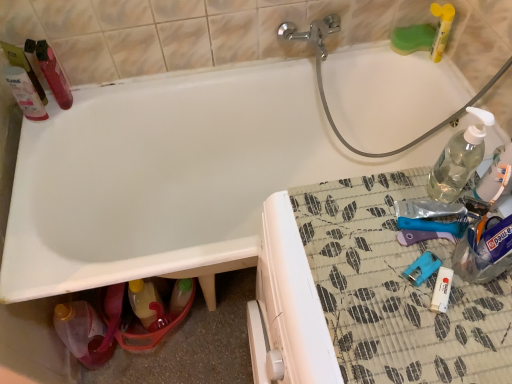
Question: Considering the positions of point (144, 304) and point (510, 183), is point (144, 304) closer or farther from the camera than point (510, 183)?

Choices:
 (A) closer
 (B) farther

Answer: (B)

Question: Which is correct: translucent yellow bottle at lower left, which is counted as the 2th bottle, starting from the bottom, is inside clear plastic bottle at upper right, positioned as the 5th bottle in left-to-right order, or outside of it?

Choices:
 (A) outside
 (B) inside

Answer: (A)

Question: Which is farther from the clear plastic bottle at upper right, which is counted as the third bottle, starting from the top?

Choices:
 (A) clear plastic bottle at upper right, the 4th bottle positioned from the left
 (B) translucent plastic bottle at lower left, the 4th bottle when ordered from right to left
 (C) translucent plastic bottle at upper left, placed as the first bottle when sorted from left to right
 (D) translucent yellow bottle at lower left, which is the 3th bottle from right to left
 (E) translucent plastic bottles at upper left

Answer: (E)

Question: Based on their relative distances, which object is farther from the translucent plastic bottles at upper left?

Choices:
 (A) clear plastic bottle at upper right, which appears as the 1th bottle when viewed from the right
 (B) clear plastic bottle at upper right, the 4th bottle positioned from the left
 (C) translucent plastic bottle at lower left, placed as the 5th bottle when sorted from top to bottom
 (D) translucent plastic bottle at upper left, which is the 5th bottle from right to left
 (E) translucent yellow bottle at lower left, which is the 3th bottle from right to left

Answer: (A)